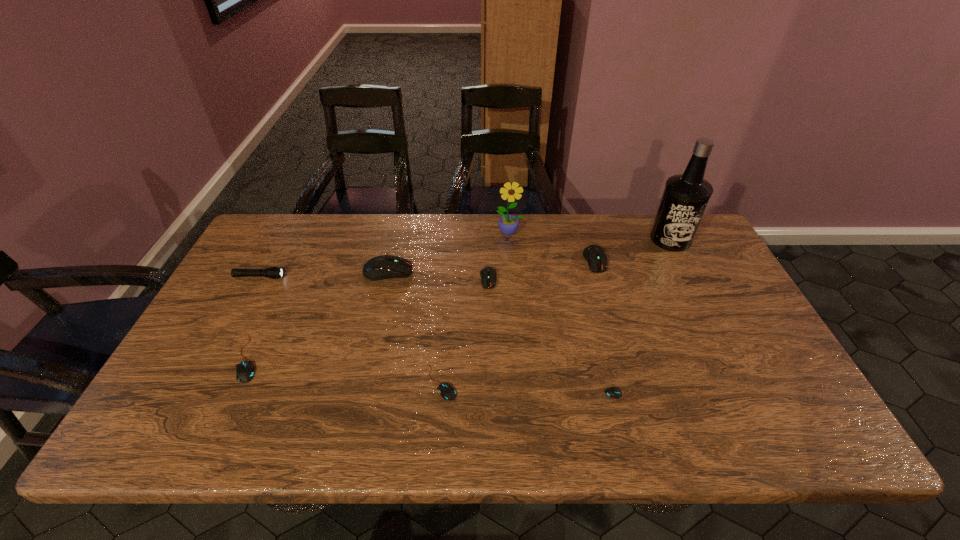
This screenshot has height=540, width=960. Find the location of `mouse situated at the left edge`. mouse situated at the left edge is located at coordinates (245, 370).

Identify the location of object that is positioned at the right edge. (685, 197).

Identify the location of object that is at the far right corner. (685, 197).

The image size is (960, 540). What are the coordinates of `free region at the far edge of the desktop` in the screenshot? It's located at (430, 216).

Locate an element on the screen. This screenshot has height=540, width=960. vacant position at the near edge of the desktop is located at coordinates 476,416.

Locate an element on the screen. vacant area at the left edge of the desktop is located at coordinates (202, 366).

Find the location of `vacant space at the right edge`. vacant space at the right edge is located at coordinates (768, 362).

Where is `vacant space at the near left corner`? The width and height of the screenshot is (960, 540). vacant space at the near left corner is located at coordinates (147, 442).

At what (x,y) coordinates should I click in order to perform the action: click on free space between the fifth object from left to right and the second tallest mouse. Please return your answer as a coordinate pair (x, y). The image size is (960, 540). Looking at the image, I should click on (541, 270).

Image resolution: width=960 pixels, height=540 pixels. In order to click on unoccupied position between the fourth object from right to left and the shortest mouse in this screenshot , I will do `click(566, 314)`.